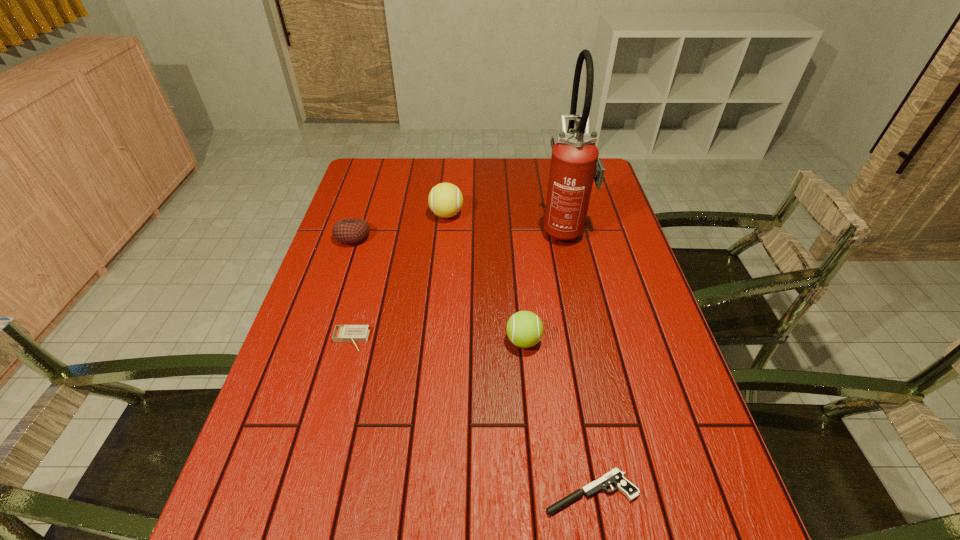
This screenshot has height=540, width=960. Identify the location of vacant area that lies between the taller tennis ball and the second shortest object. (398, 278).

Identify the location of vacant area that lies between the third shortest object and the right tennis ball. This screenshot has width=960, height=540. (439, 289).

You are a GUI agent. You are given a task and a screenshot of the screen. Output one action in this format:
    pyautogui.click(x=<x>, y=<y>)
    Task: Click on the free space between the fifth tallest object and the fire extinguisher
    The width and height of the screenshot is (960, 540).
    Given the screenshot: What is the action you would take?
    pyautogui.click(x=458, y=284)

This screenshot has height=540, width=960. Identify the location of free spot between the fourth tallest object and the fifth tallest object. (352, 288).

This screenshot has width=960, height=540. I want to click on free space between the fourth tallest object and the right tennis ball, so click(x=439, y=289).

The width and height of the screenshot is (960, 540). Find the location of `the fourth closest object to the tallest object`. the fourth closest object to the tallest object is located at coordinates (342, 333).

Select which object appears as the closest to the pistol. Please provide its 2D coordinates. Your answer should be formatted as a tuple, i.e. [(x, y)], where the tuple contains the x and y coordinates of a point satisfying the conditions above.

[(524, 329)]

You are a GUI agent. You are given a task and a screenshot of the screen. Output one action in this format:
    pyautogui.click(x=<x>, y=<y>)
    Task: Click on the vacant area in the image that satisfies the following two spatial constraints: 1. on the back side of the beanbag; 2. on the right side of the taller tennis ball
    The image size is (960, 540).
    Given the screenshot: What is the action you would take?
    pyautogui.click(x=360, y=215)

Find the location of a particular element. Image resolution: width=960 pixels, height=540 pixels. free location that satisfies the following two spatial constraints: 1. at the nozzle of the tallest object; 2. on the striking surface of the matchbox is located at coordinates (589, 340).